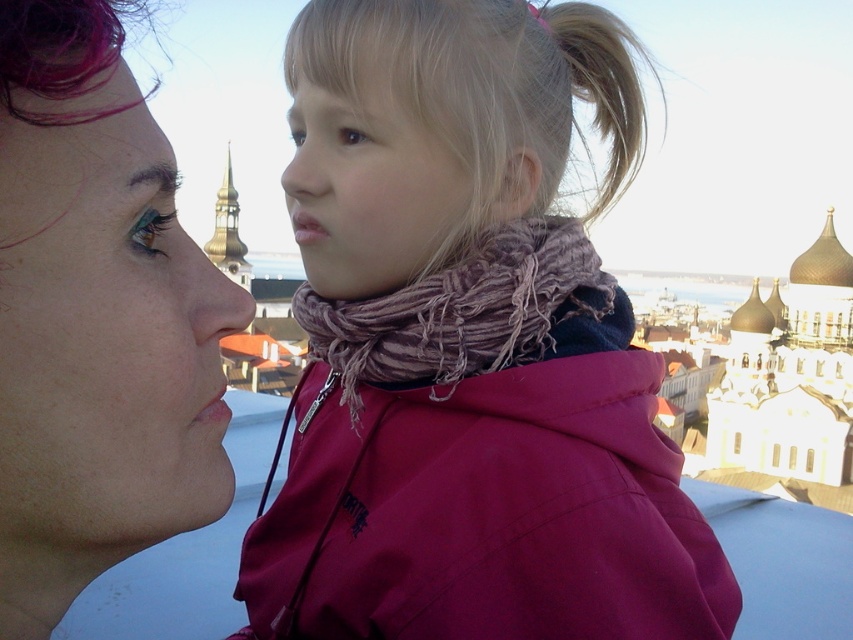
Question: Which is farther from the woolen scarf at center?

Choices:
 (A) matte pink scarf at upper right
 (B) pink fabric scarf at center
 (C) blonde hair at upper center

Answer: (A)

Question: In this image, where is matte pink scarf at upper right located relative to woolen scarf at center?

Choices:
 (A) left
 (B) right

Answer: (A)

Question: Is pink fabric scarf at center below matte pink scarf at upper right?

Choices:
 (A) no
 (B) yes

Answer: (B)

Question: Which object is positioned farthest from the woolen scarf at center?

Choices:
 (A) pink fabric scarf at center
 (B) blonde hair at upper center

Answer: (B)

Question: Where is woolen scarf at center located in relation to blonde hair at upper center in the image?

Choices:
 (A) right
 (B) left

Answer: (B)

Question: Estimate the real-world distances between objects in this image. Which object is closer to the blonde hair at upper center?

Choices:
 (A) matte pink scarf at upper right
 (B) pink fabric scarf at center
 (C) woolen scarf at center

Answer: (B)